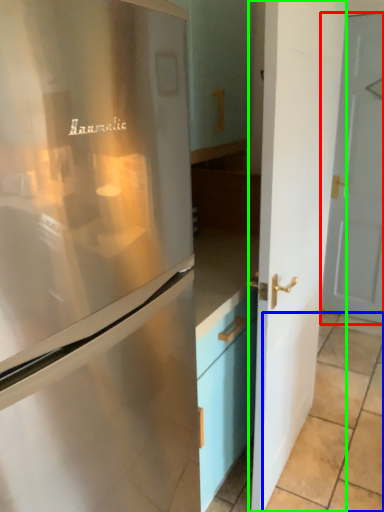
Question: Estimate the real-world distances between objects in this image. Which object is closer to door (highlighted by a red box), tile (highlighted by a blue box) or door (highlighted by a green box)?

Choices:
 (A) tile
 (B) door

Answer: (A)